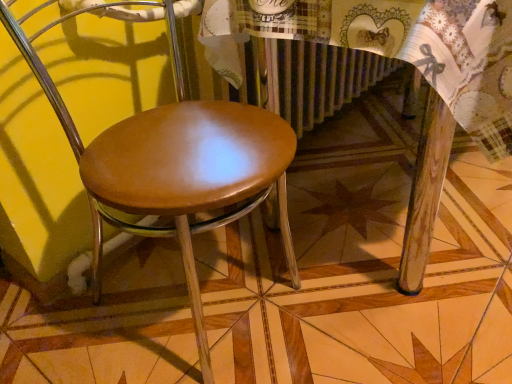
You are a GUI agent. You are given a task and a screenshot of the screen. Output one action in this format:
    pyautogui.click(x=<x>, y=<y>)
    Task: Click on the free space to the right of shiny brown wood chair at center
    
    Given the screenshot: What is the action you would take?
    pyautogui.click(x=357, y=279)